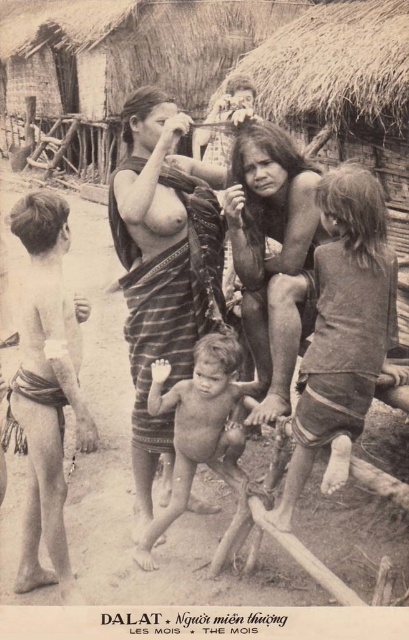
Question: Does light brown skin at left appear on the left side of naked skin child at center?

Choices:
 (A) no
 (B) yes

Answer: (B)

Question: Does light brown skin at left appear over naked skin child at center?

Choices:
 (A) yes
 (B) no

Answer: (A)

Question: Does dark brown fabric shorts at center have a smaller size compared to light brown skin at left?

Choices:
 (A) yes
 (B) no

Answer: (A)

Question: Among these points, which one is farthest from the camera?

Choices:
 (A) (370, 188)
 (B) (44, 273)

Answer: (B)

Question: Among these points, which one is nearest to the camera?

Choices:
 (A) (229, 422)
 (B) (45, 356)

Answer: (B)

Question: Which point is closer to the camera taking this photo?

Choices:
 (A) (184, 504)
 (B) (337, 305)

Answer: (B)